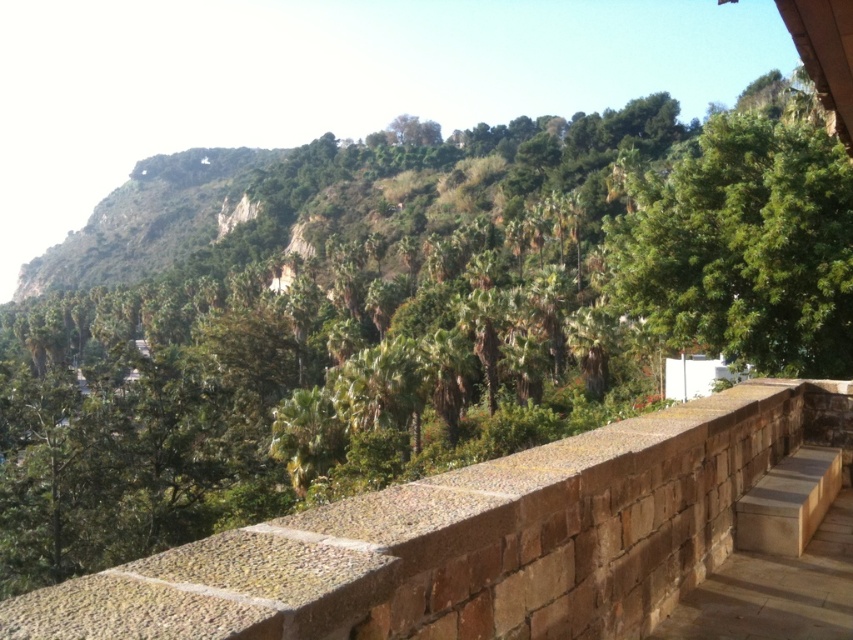
You are standing on a balcony and want to place a small potted plant on the brown stone ledge at center. Considering the size of the ledge, will the potted plant fit comfortably without overhanging the edge? Please refer to the green leafy tree at center for comparison.

The brown stone ledge at center is smaller than the green leafy tree at center. Since the ledge is smaller, placing a small potted plant on it may still be possible, but it might overhang the edge depending on the plant size. Compare the ledge size to the tree to ensure the plant fits comfortably.

You are standing on the paved walkway and want to place a small potted plant exactly at the center of the brown stone ledge at center. According to the coordinates provided, where should you position the potted plant?

The brown stone ledge at center has its 2D location at point (474, 540), so you should position the potted plant precisely at those coordinates to place it exactly at the center of the brown stone ledge at center.

You are standing on a paved walkway leading to a stone railing. There is a point marked at coordinates (474, 540). Based on the scene, where is this point located?

The point (474, 540) is on the brown stone ledge at center.